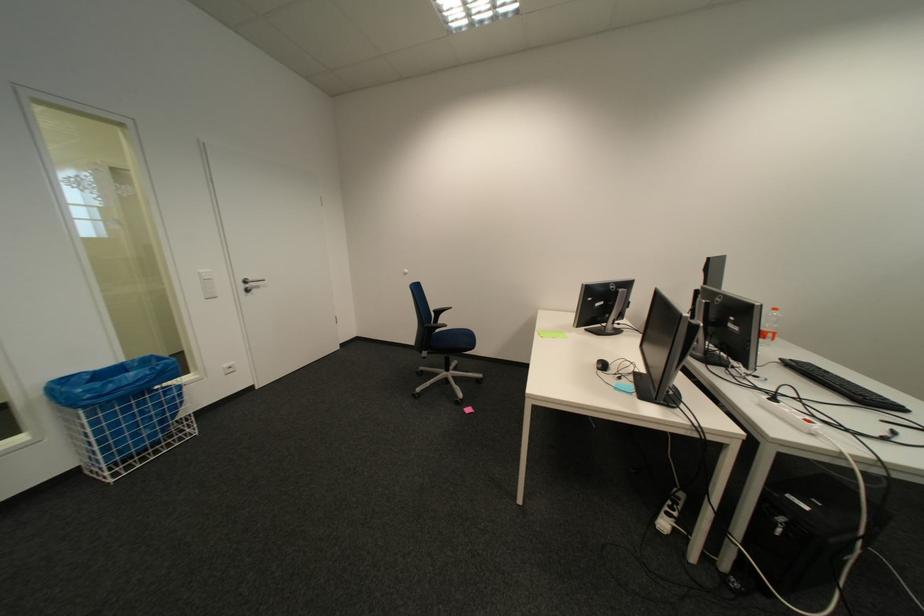
Where is `white light switch`? white light switch is located at coordinates (208, 284).